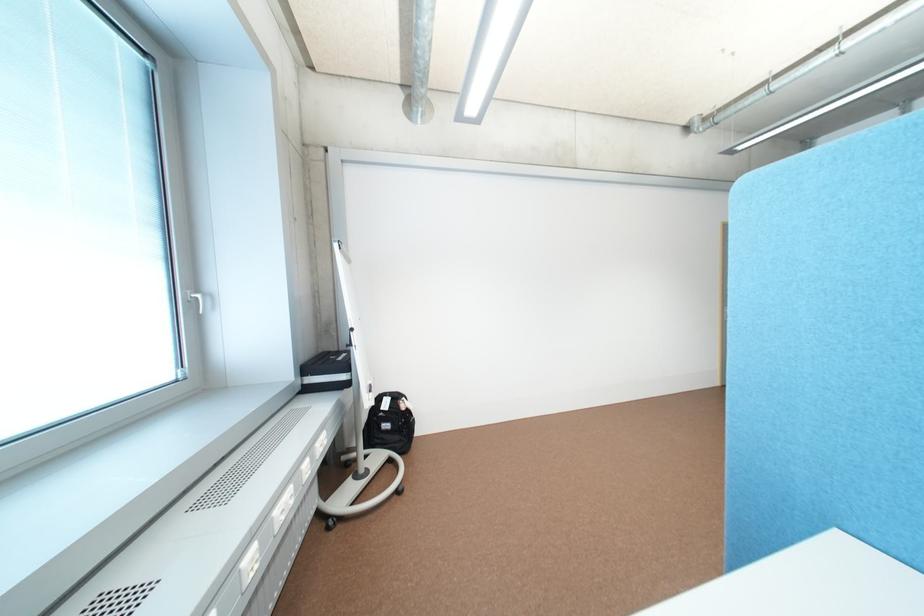
Identify the location of black equipment case. The width and height of the screenshot is (924, 616). (325, 371).